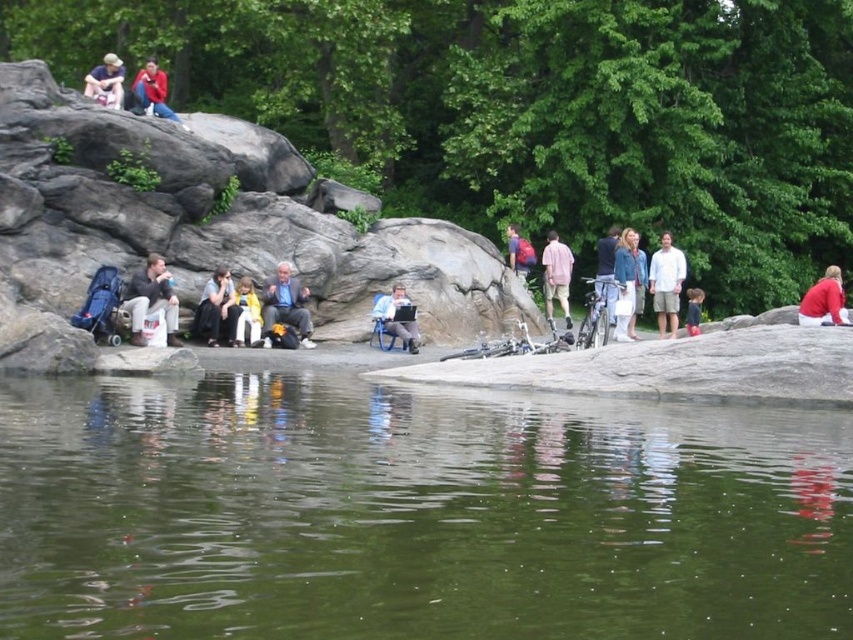
Question: Which of these objects is positioned closest to the yellow fabric jacket at center?

Choices:
 (A) light pink fabric dress at center
 (B) gray rock at center

Answer: (B)

Question: Is the position of matte gray jacket at center less distant than that of light pink fabric dress at center?

Choices:
 (A) no
 (B) yes

Answer: (B)

Question: Is denim jacket at center to the right of matte white shirt at upper left from the viewer's perspective?

Choices:
 (A) yes
 (B) no

Answer: (A)

Question: Which of these objects is positioned farthest from the dark gray fabric jacket at center?

Choices:
 (A) light pink fabric dress at center
 (B) white cotton shirt at center
 (C) gray rock at center

Answer: (A)

Question: Does matte gray jacket at center appear over matte blue backpack at center?

Choices:
 (A) no
 (B) yes

Answer: (A)

Question: Which is nearer to the dark blue shirt at center?

Choices:
 (A) matte gray chair at center
 (B) dark gray fabric jacket at center

Answer: (A)